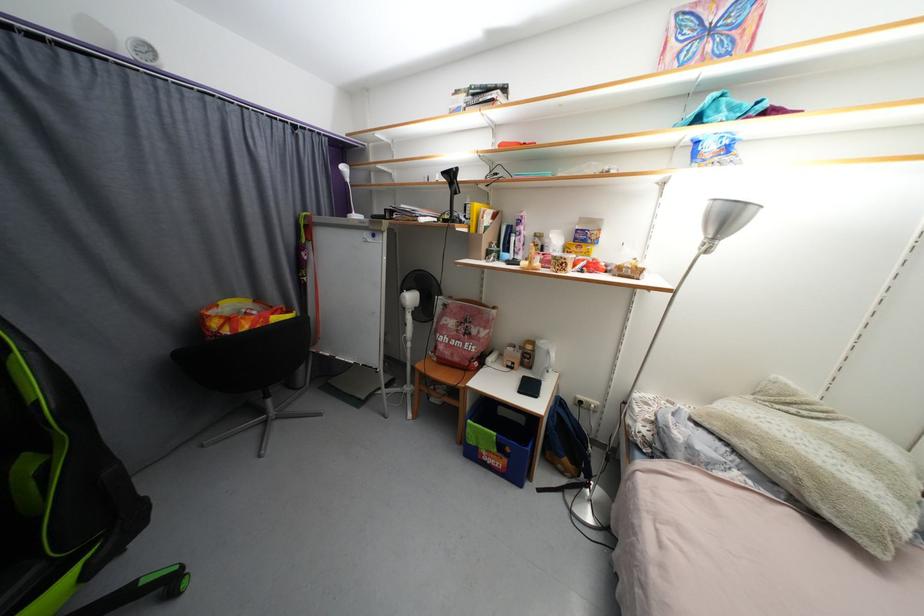
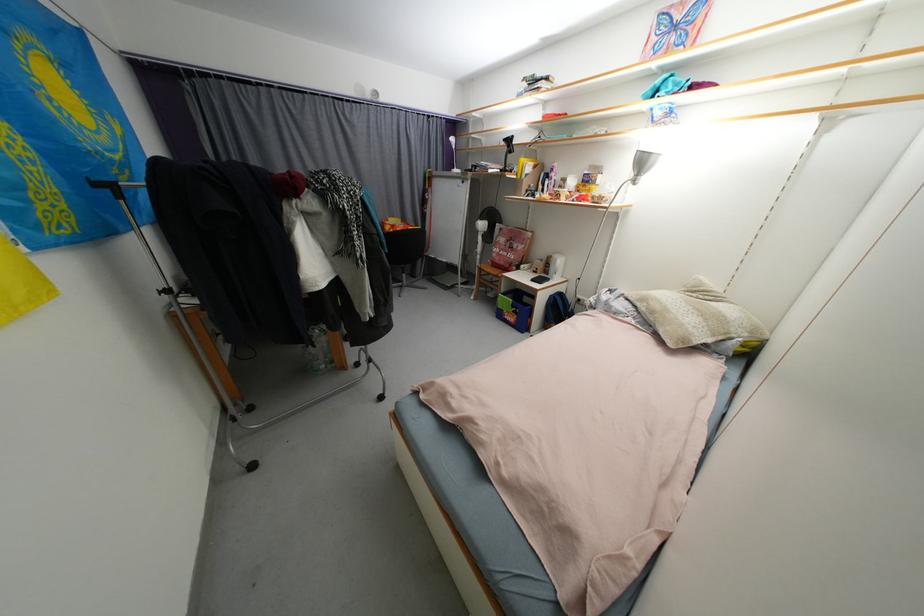
In the second image, find the point that corresponds to (x=565, y=405) in the first image.

(565, 297)